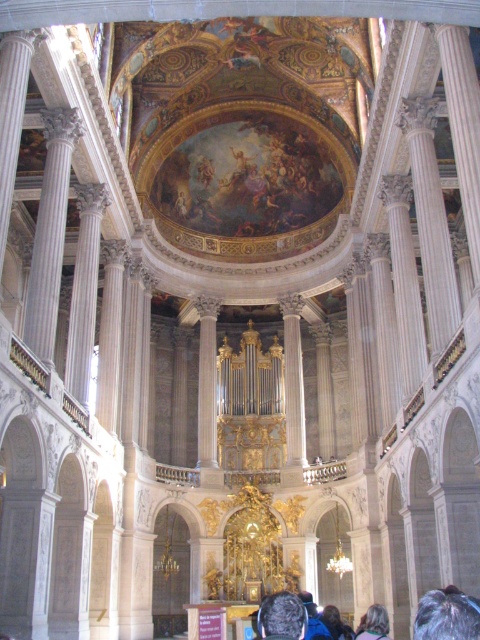
You are standing inside the grand church and want to walk towards the two points marked in the image. Which point, point [371,620] or point [344,634], would you reach first if you move straight ahead?

Point [371,620] is in front of point [344,634], so you would reach point [371,620] first.

In the scene shown: You are standing in the grand cathedral and notice a specific point marked at coordinates point (446, 616). What is the object located at this point?

The point (446, 616) indicates gray hair at upper center.